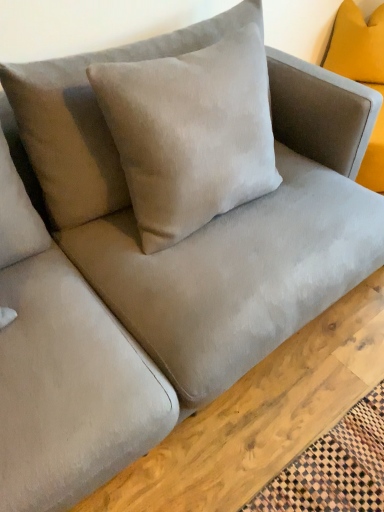
Question: Considering the relative sizes of suede-like beige pillow at center, positioned as the 1th pillow in bottom-to-top order, and mustard velvet pillow at upper right, arranged as the second pillow when ordered from the bottom, in the image provided, is suede-like beige pillow at center, positioned as the 1th pillow in bottom-to-top order, thinner than mustard velvet pillow at upper right, arranged as the second pillow when ordered from the bottom,?

Choices:
 (A) yes
 (B) no

Answer: (B)

Question: From the image's perspective, is suede-like beige pillow at center, placed as the 2th pillow when sorted from right to left, under mustard velvet pillow at upper right, which ranks as the first pillow in right-to-left order?

Choices:
 (A) no
 (B) yes

Answer: (B)

Question: From a real-world perspective, is suede-like beige pillow at center, positioned as the 2th pillow in top-to-bottom order, on mustard velvet pillow at upper right, acting as the 1th pillow starting from the top?

Choices:
 (A) no
 (B) yes

Answer: (B)

Question: Can you confirm if suede-like beige pillow at center, placed as the first pillow when sorted from left to right, is positioned to the right of mustard velvet pillow at upper right, which is the 1th pillow from back to front?

Choices:
 (A) yes
 (B) no

Answer: (B)

Question: Can you confirm if suede-like beige pillow at center, placed as the first pillow when sorted from left to right, is taller than mustard velvet pillow at upper right, which appears as the 2th pillow when viewed from the left?

Choices:
 (A) yes
 (B) no

Answer: (A)

Question: Are suede-like beige pillow at center, positioned as the 1th pillow in bottom-to-top order, and mustard velvet pillow at upper right, acting as the 1th pillow starting from the top, located far from each other?

Choices:
 (A) yes
 (B) no

Answer: (A)

Question: Can you confirm if matte gray couch at center is shorter than mustard velvet pillow at upper right, placed as the 2th pillow when sorted from front to back?

Choices:
 (A) yes
 (B) no

Answer: (A)

Question: Considering the relative positions of matte gray couch at center and mustard velvet pillow at upper right, which is the 1th pillow from back to front, in the image provided, is matte gray couch at center to the left of mustard velvet pillow at upper right, which is the 1th pillow from back to front, from the viewer's perspective?

Choices:
 (A) no
 (B) yes

Answer: (B)

Question: Could you tell me if matte gray couch at center is turned towards mustard velvet pillow at upper right, placed as the 2th pillow when sorted from front to back?

Choices:
 (A) no
 (B) yes

Answer: (A)

Question: From the image's perspective, does matte gray couch at center appear lower than mustard velvet pillow at upper right, arranged as the second pillow when ordered from the bottom?

Choices:
 (A) no
 (B) yes

Answer: (B)

Question: Does matte gray couch at center have a larger size compared to mustard velvet pillow at upper right, which is the 1th pillow from back to front?

Choices:
 (A) yes
 (B) no

Answer: (A)

Question: Can you confirm if matte gray couch at center is thinner than mustard velvet pillow at upper right, placed as the 2th pillow when sorted from front to back?

Choices:
 (A) no
 (B) yes

Answer: (A)

Question: Is mustard velvet pillow at upper right, arranged as the second pillow when ordered from the bottom, looking in the opposite direction of suede-like beige pillow at center, placed as the first pillow when sorted from left to right?

Choices:
 (A) no
 (B) yes

Answer: (A)